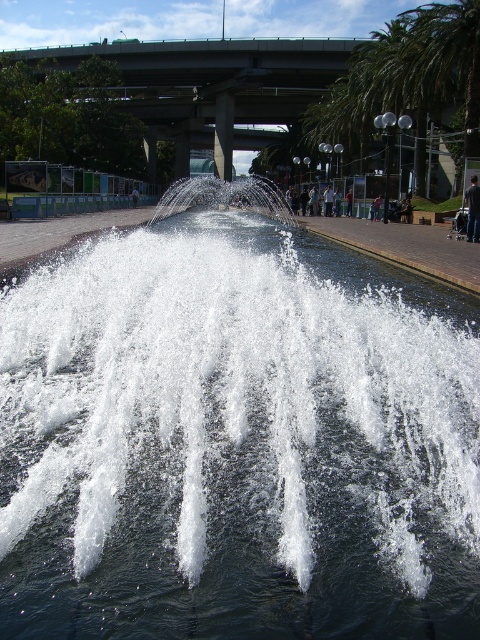
You are a photographer trying to capture both the white frothy water at center and the dark gray fabric at center in a single shot. Based on their sizes, do you think you can fit both into your camera frame without zooming in?

The white frothy water at center might be wider than dark gray fabric at center, so there is a possibility that both can fit into the frame if the camera is positioned appropriately to accommodate the wider object.

You are standing in the public square facing the fountain. There are two points marked in the scene. The first point is at coordinates point (331, 61) and the second point is at point (469, 230). Which point is closer to you?

Point (331, 61) is further to the camera than point (469, 230), so the point closer to you is point (469, 230).